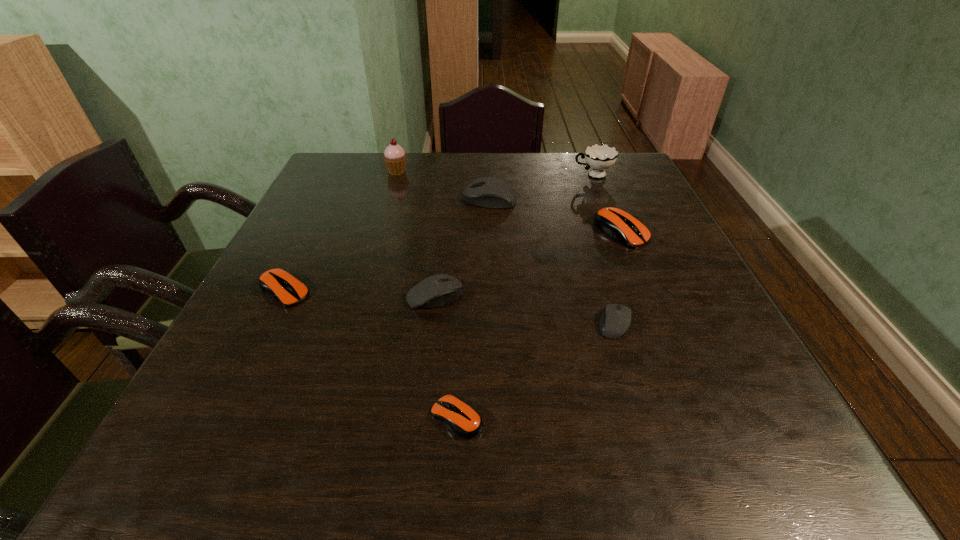
The height and width of the screenshot is (540, 960). What are the coordinates of `vacant space located 0.070m on the left of the second smallest black computer equipment` in the screenshot? It's located at point(372,296).

Where is `free space located on the back of the leftmost computer mouse`? This screenshot has height=540, width=960. free space located on the back of the leftmost computer mouse is located at coordinates (x=311, y=238).

Find the location of a particular element. The width and height of the screenshot is (960, 540). vacant space located 0.240m on the front of the smallest black computer equipment is located at coordinates (660, 466).

You are a GUI agent. You are given a task and a screenshot of the screen. Output one action in this format:
    pyautogui.click(x=<x>, y=<y>)
    Task: Click on the vacant space located 0.210m on the right of the nearest object
    The height and width of the screenshot is (540, 960).
    Given the screenshot: What is the action you would take?
    pyautogui.click(x=615, y=418)

Locate an element on the screen. cupcake that is at the far edge is located at coordinates (394, 157).

This screenshot has height=540, width=960. Find the location of `cup that is at the far edge`. cup that is at the far edge is located at coordinates (599, 157).

The height and width of the screenshot is (540, 960). Identify the location of computer equipment located at the far edge. (489, 192).

Where is `object that is at the near edge`? Image resolution: width=960 pixels, height=540 pixels. object that is at the near edge is located at coordinates (462, 419).

Where is `object at the left edge`? The height and width of the screenshot is (540, 960). object at the left edge is located at coordinates (279, 284).

Locate an element on the screen. cup situated at the right edge is located at coordinates (599, 157).